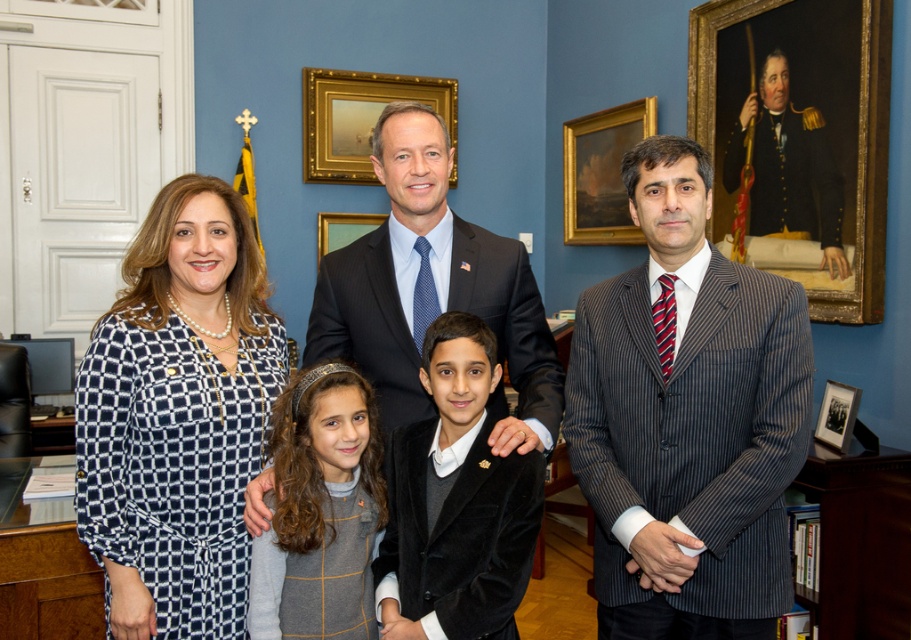
Question: Which point is farther from the camera taking this photo?

Choices:
 (A) (432, 108)
 (B) (295, 600)

Answer: (A)

Question: Which point is farther to the camera?

Choices:
 (A) (320, 301)
 (B) (781, 83)

Answer: (B)

Question: Does dark blue uniform at upper right appear on the right side of gold-framed painting at upper center?

Choices:
 (A) yes
 (B) no

Answer: (A)

Question: Which object is the closest to the gold-framed painting at upper center?

Choices:
 (A) goldwooden frame at upper center
 (B) wooden picture frame at right

Answer: (A)

Question: Is the position of dark blue pinstripe suit at center more distant than that of gray wool dress at center?

Choices:
 (A) no
 (B) yes

Answer: (B)

Question: In this image, where is striped wool suit at center located relative to gray wool dress at center?

Choices:
 (A) left
 (B) right

Answer: (B)